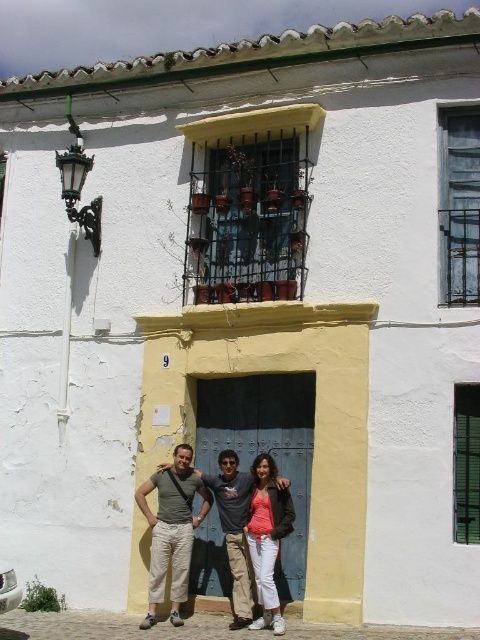
Between beige cotton pants at center and matte pink shirt at center, which one has less height?

Standing shorter between the two is matte pink shirt at center.

Is point (180, 528) farther from camera compared to point (251, 541)?

Yes, point (180, 528) is farther from viewer.

Locate an element on the screen. The height and width of the screenshot is (640, 480). beige cotton pants at center is located at coordinates (171, 531).

Does point (164, 547) lie behind point (186, 476)?

That is False.

Between matte gray pants at center and beige cotton pants at center, which one has more height?

With more height is beige cotton pants at center.

Identify the location of matte gray pants at center. (195, 528).

Can you confirm if matte gray pants at center is taller than matte pink shirt at center?

No.

Based on the photo, between matte gray pants at center and matte pink shirt at center, which one appears on the left side from the viewer's perspective?

matte gray pants at center

Who is more distant from viewer, [151,618] or [257,481]?

The point [257,481] is behind.

Locate an element on the screen. This screenshot has height=640, width=480. matte gray pants at center is located at coordinates (195, 528).